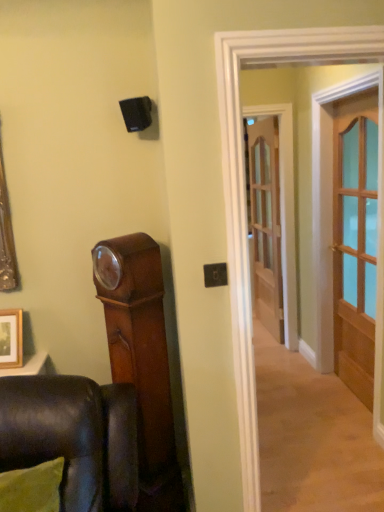
In order to face clear glass door at center, the second door when ordered from right to left, should I rotate leftwards or rightwards?

You should look right and rotate roughly 9.573 degrees.

Locate an element on the screen. The height and width of the screenshot is (512, 384). wooden picture frame at lower left is located at coordinates (11, 338).

From the wooden picture frame at lower left, count 1st door to the right and point to it. Please provide its 2D coordinates.

[(265, 221)]

From the picture: Could you tell me if clear glass door at center, which is counted as the second door, starting from the front, is facing wooden picture frame at lower left?

No, clear glass door at center, which is counted as the second door, starting from the front, is not turned towards wooden picture frame at lower left.

Can you see clear glass door at center, which is counted as the first door, starting from the back, touching wooden picture frame at lower left?

→ clear glass door at center, which is counted as the first door, starting from the back, is not next to wooden picture frame at lower left, and they're not touching.

Based on the photo, who is taller, clear glass door at center, the second door when ordered from right to left, or wooden picture frame at lower left?

Standing taller between the two is clear glass door at center, the second door when ordered from right to left.

Is clear glass door at center, which is counted as the first door, starting from the back, positioned behind light brown wooden door at right, which is counted as the second door, starting from the left?

Yes.

Considering the positions of points (258, 162) and (352, 123), is point (258, 162) farther from camera compared to point (352, 123)?

Yes, point (258, 162) is farther from viewer.

Does clear glass door at center, the 1th door when ordered from left to right, have a smaller size compared to light brown wooden door at right, which appears as the first door when viewed from the right?

Yes.

From a real-world perspective, which is physically below, clear glass door at center, which is counted as the first door, starting from the back, or light brown wooden door at right, which is the first door in front-to-back order?

From a 3D spatial view, clear glass door at center, which is counted as the first door, starting from the back, is below.

Which point is more distant from viewer, (337, 161) or (9, 310)?

Point (337, 161)

From a real-world perspective, who is located lower, light brown wooden door at right, which appears as the first door when viewed from the right, or wooden picture frame at lower left?

From a 3D spatial view, wooden picture frame at lower left is below.

Is there a large distance between light brown wooden door at right, which is the first door in front-to-back order, and wooden picture frame at lower left?

light brown wooden door at right, which is the first door in front-to-back order, is far away from wooden picture frame at lower left.

Consider the image. How different are the orientations of light brown wooden door at right, which is the first door in front-to-back order, and wooden picture frame at lower left in degrees?

There is a 90.2-degree angle between the facing directions of light brown wooden door at right, which is the first door in front-to-back order, and wooden picture frame at lower left.

Image resolution: width=384 pixels, height=512 pixels. Find the location of `door above the wooden picture frame at lower left (from a real-world perspective)`. door above the wooden picture frame at lower left (from a real-world perspective) is located at coordinates (355, 240).

Is the surface of wooden picture frame at lower left in direct contact with light brown wooden door at right, which is counted as the second door, starting from the left?

wooden picture frame at lower left and light brown wooden door at right, which is counted as the second door, starting from the left, are clearly separated.

Which object is closer to the camera, wooden picture frame at lower left or light brown wooden door at right, which is the first door in front-to-back order?

Positioned in front is wooden picture frame at lower left.

Considering the positions of objects wooden picture frame at lower left and light brown wooden door at right, which appears as the first door when viewed from the right, in the image provided, who is more to the right, wooden picture frame at lower left or light brown wooden door at right, which appears as the first door when viewed from the right,?

light brown wooden door at right, which appears as the first door when viewed from the right, is more to the right.

How many degrees apart are the facing directions of light brown wooden door at right, which appears as the first door when viewed from the right, and clear glass door at center, which is counted as the second door, starting from the front?

They differ by 3.72 degrees in their facing directions.

From a real-world perspective, between light brown wooden door at right, which is the first door in front-to-back order, and clear glass door at center, which is counted as the first door, starting from the back, who is vertically lower?

clear glass door at center, which is counted as the first door, starting from the back.

Which of these two, light brown wooden door at right, which is counted as the second door, starting from the left, or clear glass door at center, the second door when ordered from right to left, is wider?

With larger width is light brown wooden door at right, which is counted as the second door, starting from the left.

This screenshot has height=512, width=384. I want to click on door directly beneath the light brown wooden door at right, which is the first door in front-to-back order (from a real-world perspective), so click(265, 221).

Is wooden picture frame at lower left at the right side of clear glass door at center, the 1th door when ordered from left to right?

In fact, wooden picture frame at lower left is to the left of clear glass door at center, the 1th door when ordered from left to right.

Looking at this image, in terms of width, does wooden picture frame at lower left look wider or thinner when compared to clear glass door at center, the second door when ordered from right to left?

wooden picture frame at lower left is wider than clear glass door at center, the second door when ordered from right to left.

Based on their sizes in the image, would you say wooden picture frame at lower left is bigger or smaller than clear glass door at center, the 1th door when ordered from left to right?

Considering their sizes, wooden picture frame at lower left takes up less space than clear glass door at center, the 1th door when ordered from left to right.

From the image's perspective, who appears lower, wooden picture frame at lower left or clear glass door at center, the second door when ordered from right to left?

wooden picture frame at lower left appears lower in the image.

The height and width of the screenshot is (512, 384). Identify the location of the 2nd door above the wooden picture frame at lower left (from the image's perspective). (265, 221).

At what (x,y) coordinates should I click in order to perform the action: click on door on the right of clear glass door at center, the 1th door when ordered from left to right. Please return your answer as a coordinate pair (x, y). The height and width of the screenshot is (512, 384). Looking at the image, I should click on click(355, 240).

Based on their spatial positions, is clear glass door at center, the 1th door when ordered from left to right, or wooden picture frame at lower left further from light brown wooden door at right, positioned as the second door in back-to-front order?

wooden picture frame at lower left is further to light brown wooden door at right, positioned as the second door in back-to-front order.

Which object lies further to the anchor point clear glass door at center, the second door when ordered from right to left, light brown wooden door at right, which appears as the first door when viewed from the right, or wooden picture frame at lower left?

Based on the image, wooden picture frame at lower left appears to be further to clear glass door at center, the second door when ordered from right to left.

When comparing their distances from clear glass door at center, the second door when ordered from right to left, does wooden picture frame at lower left or light brown wooden door at right, which is the first door in front-to-back order, seem closer?

light brown wooden door at right, which is the first door in front-to-back order.

Which object lies nearer to the anchor point wooden picture frame at lower left, light brown wooden door at right, which is the first door in front-to-back order, or clear glass door at center, the second door when ordered from right to left?

light brown wooden door at right, which is the first door in front-to-back order, is positioned closer to the anchor wooden picture frame at lower left.

From the image, which object appears to be farther from light brown wooden door at right, which is the first door in front-to-back order, wooden picture frame at lower left or clear glass door at center, which is counted as the second door, starting from the front?

wooden picture frame at lower left.

Considering their positions, is clear glass door at center, the 1th door when ordered from left to right, positioned further to wooden picture frame at lower left than light brown wooden door at right, positioned as the second door in back-to-front order?

clear glass door at center, the 1th door when ordered from left to right, is further to wooden picture frame at lower left.

Find the location of a particular element. This screenshot has height=512, width=384. door between wooden picture frame at lower left and light brown wooden door at right, which appears as the first door when viewed from the right, in the horizontal direction is located at coordinates (265, 221).